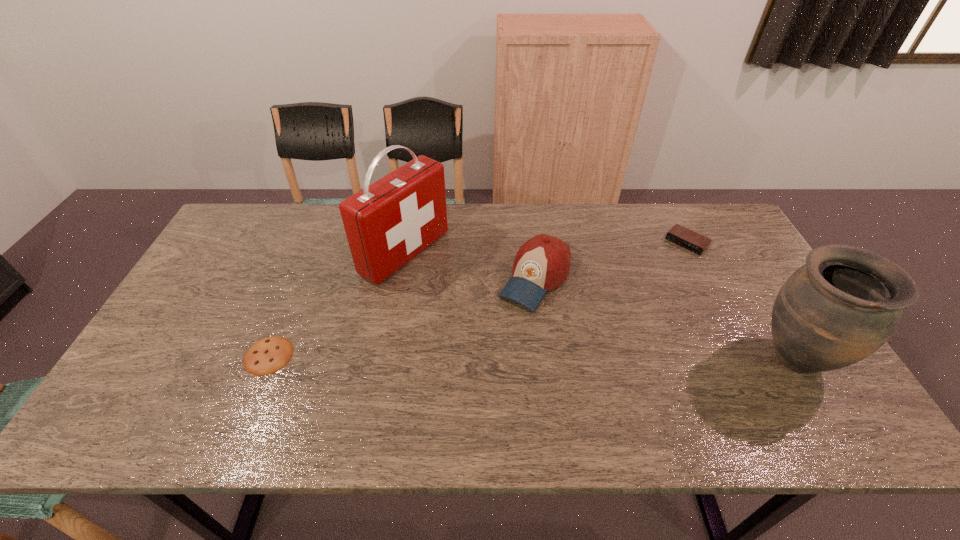
Identify the location of free space at the left edge of the desktop. (257, 253).

Where is `free space at the right edge of the desktop`? This screenshot has width=960, height=540. free space at the right edge of the desktop is located at coordinates [x=772, y=343].

Locate an element on the screen. vacant space at the far left corner is located at coordinates (276, 210).

The height and width of the screenshot is (540, 960). I want to click on empty location between the fourth object from right to left and the leftmost object, so click(x=337, y=304).

Find the location of a particular element. vacant area that lies between the fourth object from right to left and the leftmost object is located at coordinates (337, 304).

The height and width of the screenshot is (540, 960). I want to click on empty space between the third tallest object and the urn, so click(x=664, y=319).

This screenshot has width=960, height=540. In order to click on vacant point located between the third object from right to left and the alarm clock in this screenshot , I will do `click(611, 261)`.

At what (x,y) coordinates should I click in order to perform the action: click on blank region between the tallest object and the baseball cap. Please return your answer as a coordinate pair (x, y). Image resolution: width=960 pixels, height=540 pixels. Looking at the image, I should click on (470, 266).

Locate an element on the screen. This screenshot has width=960, height=540. free spot between the third object from right to left and the cookie is located at coordinates (402, 318).

Where is `vacant region between the fourth object from right to left and the third tallest object`? The image size is (960, 540). vacant region between the fourth object from right to left and the third tallest object is located at coordinates (470, 266).